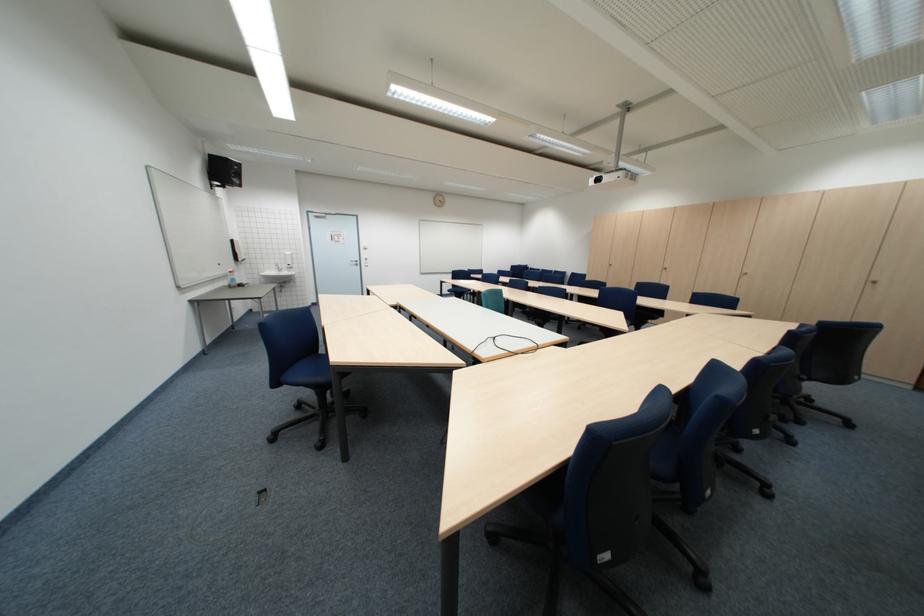
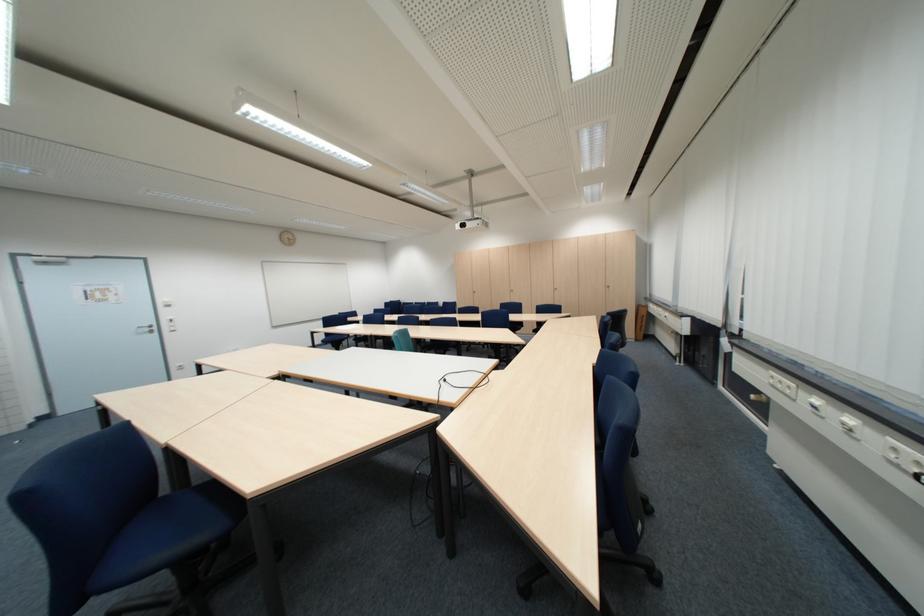
Question: The first image is from the beginning of the video and the second image is from the end. How did the camera likely rotate when shooting the video?

Choices:
 (A) Left
 (B) Right
 (C) Up
 (D) Down

Answer: (B)